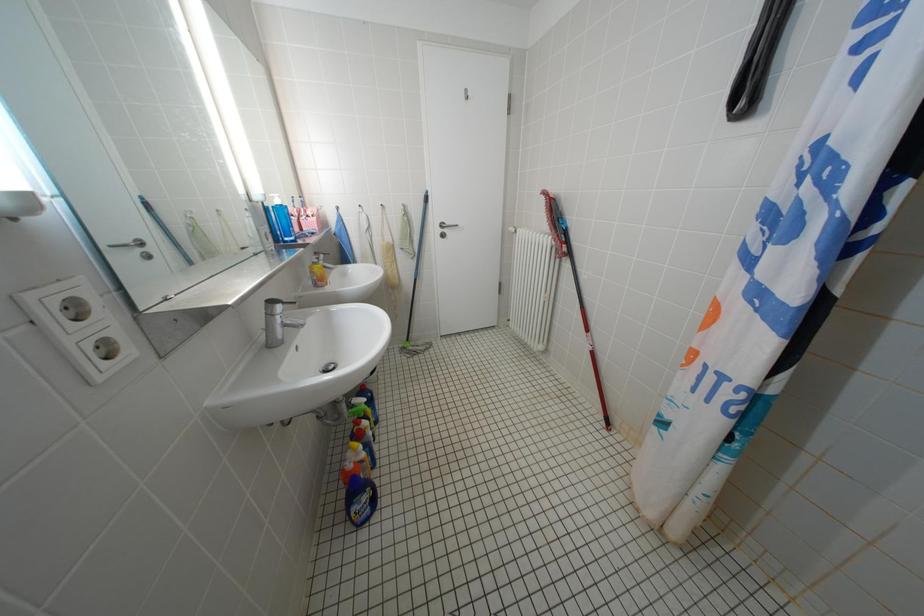
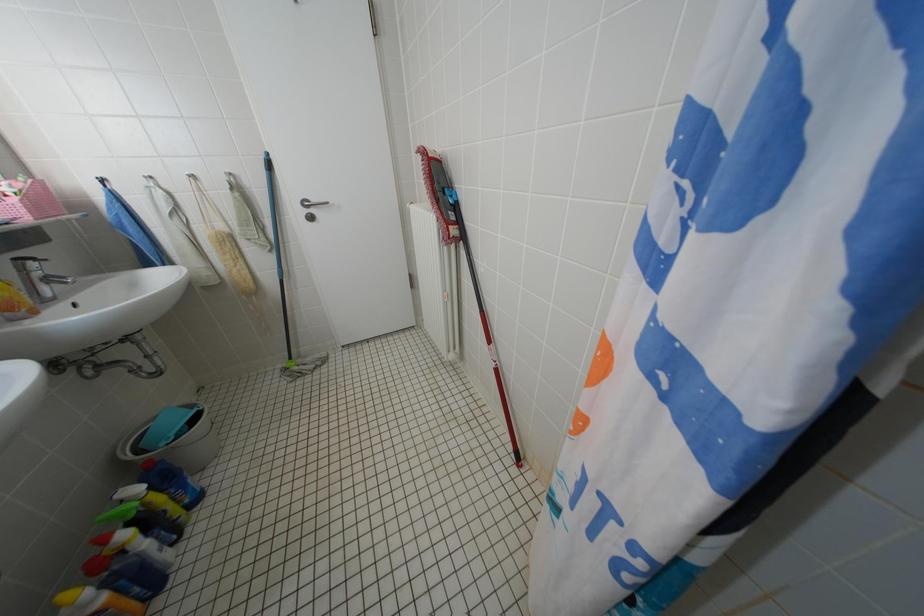
The images are taken continuously from a first-person perspective. In which direction are you moving?

The cameraman walked toward right, forward.